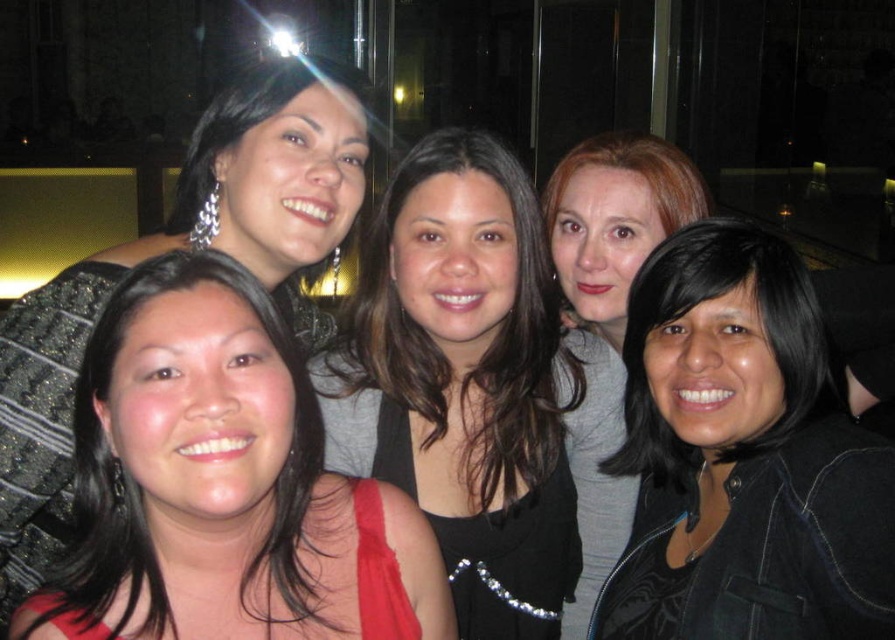
You are a photographer adjusting your camera settings to focus on the black matte jacket at lower right and the shiny black hair at center. Which object should you focus on first if you want to capture both in sharp detail?

You should focus on the black matte jacket at lower right first because it is closer to the viewer than the shiny black hair at center, allowing you to adjust the focus accordingly for both subjects.

You are a photographer trying to adjust the lighting for the group photo. You notice two elements in the scene that might reflect light differently. Which object is placed lower in the image between the shiny black dress at lower left and the shiny black hair at center?

The shiny black dress at lower left is positioned under the shiny black hair at center, so the shiny black dress at lower left is placed lower in the image.

You are a photographer at the event and want to adjust your camera focus to capture the black matte jacket at lower right clearly. Given that the camera can focus on objects within 3 feet, will the jacket be in focus?

The black matte jacket at lower right is 3.36 feet from the camera, which is slightly beyond the camera focus range of 3 feet. Therefore, the jacket will not be in focus.